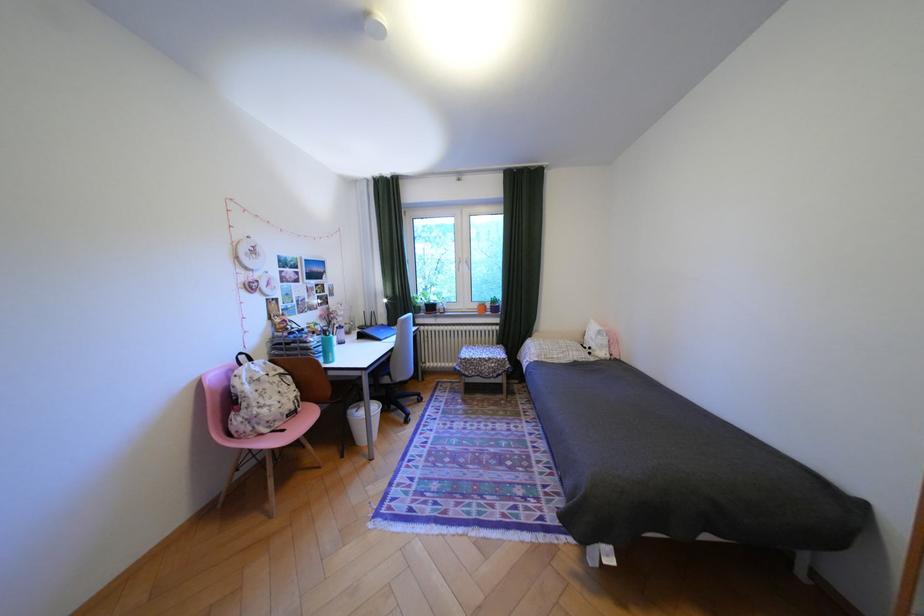
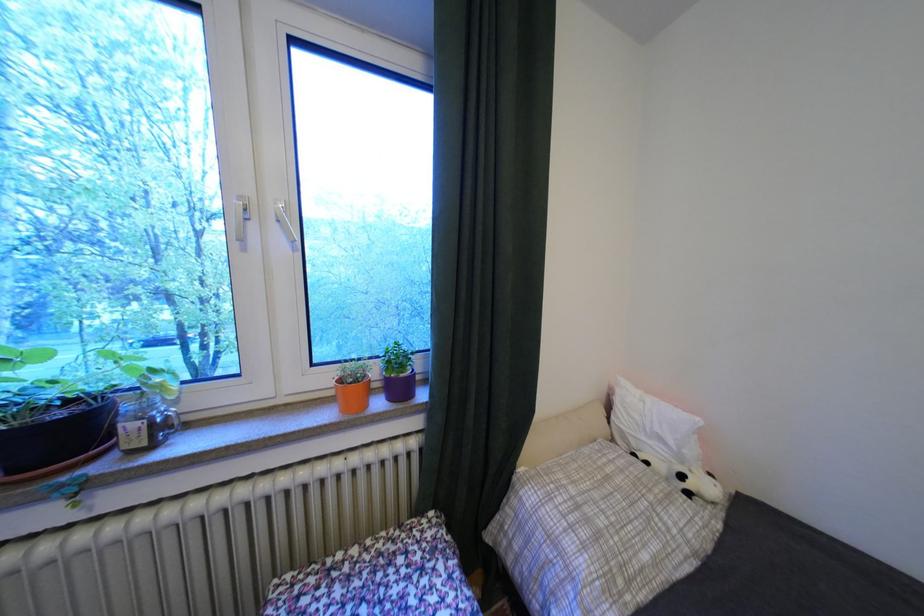
Locate, in the second image, the point that corresponds to (444,309) in the first image.

(75, 436)